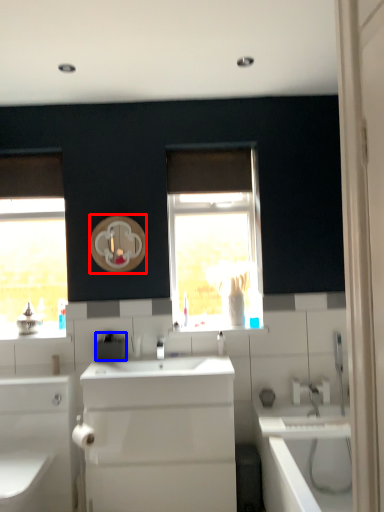
Question: Among these objects, which one is farthest to the camera, mirror (highlighted by a red box) or appliance (highlighted by a blue box)?

Choices:
 (A) mirror
 (B) appliance

Answer: (A)